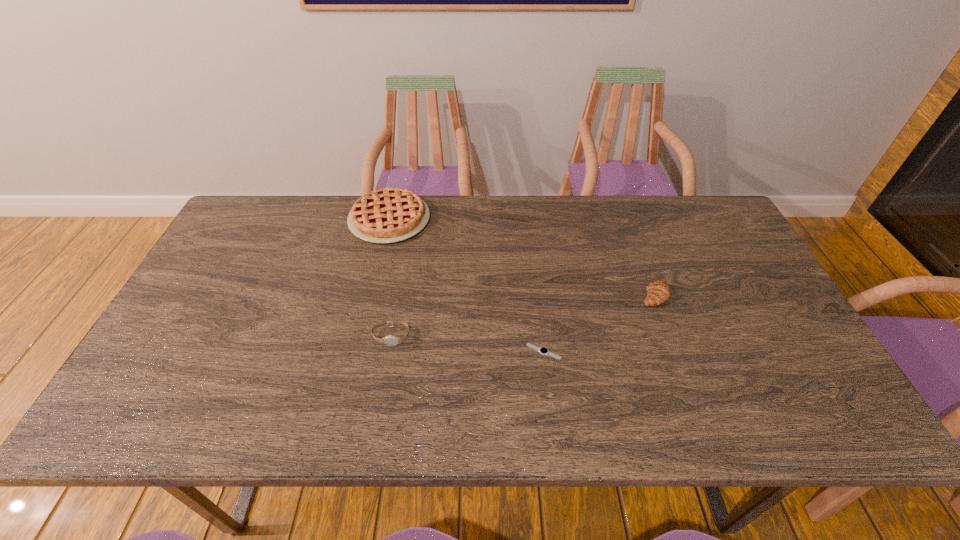
The width and height of the screenshot is (960, 540). Identify the location of free space located 0.290m on the left of the third object from left to right. (408, 352).

Where is `object that is at the far edge`? The image size is (960, 540). object that is at the far edge is located at coordinates (388, 215).

This screenshot has height=540, width=960. Identify the location of blank area at the far edge. (494, 232).

At what (x,y) coordinates should I click in order to perform the action: click on vacant space at the near edge of the desktop. Please return your answer as a coordinate pair (x, y). The width and height of the screenshot is (960, 540). Looking at the image, I should click on (518, 418).

I want to click on free spot at the left edge of the desktop, so tap(199, 299).

In order to click on blank space at the right edge of the desktop in this screenshot , I will do pos(807,375).

This screenshot has width=960, height=540. In the image, there is a desktop. Identify the location of free region at the far left corner. (258, 204).

Where is `free space at the near left corner`? This screenshot has width=960, height=540. free space at the near left corner is located at coordinates (122, 417).

Where is `free point at the near right corner`? Image resolution: width=960 pixels, height=540 pixels. free point at the near right corner is located at coordinates (822, 426).

At what (x,y) coordinates should I click in order to perform the action: click on free space that is in between the farthest object and the rightmost object. Please return your answer as a coordinate pair (x, y). The height and width of the screenshot is (540, 960). Looking at the image, I should click on (522, 257).